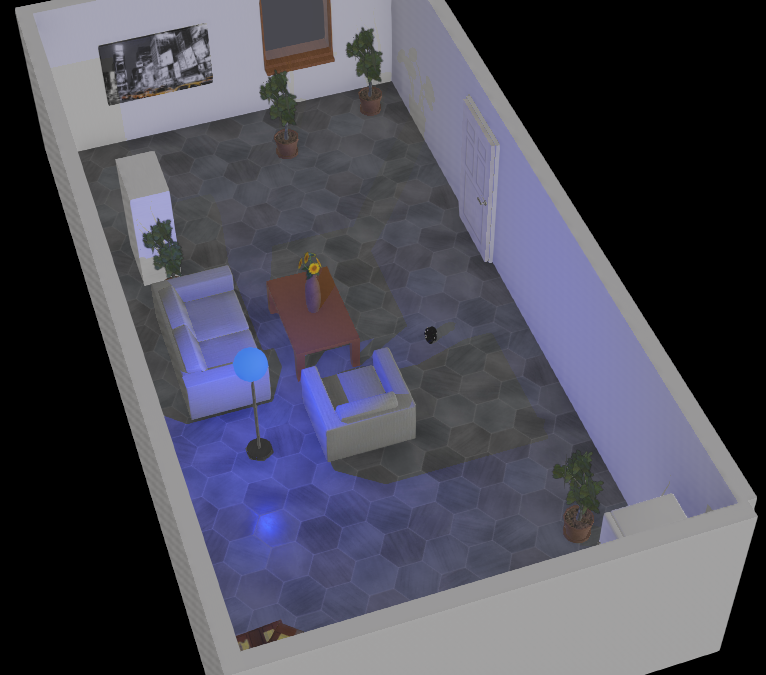
The width and height of the screenshot is (766, 675). What are the coordinates of `floorlamp` in the screenshot? It's located at (259, 445).